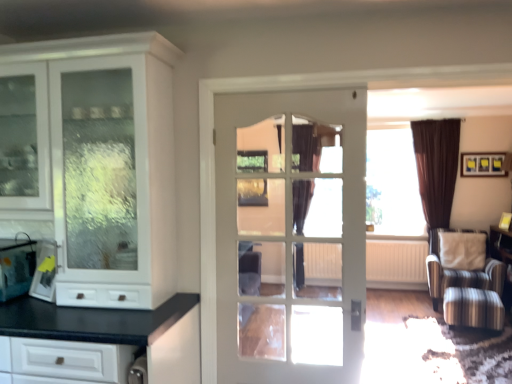
Question: Is beige fabric pillow at right taller or shorter than white glossy cabinet at left?

Choices:
 (A) short
 (B) tall

Answer: (A)

Question: From the image's perspective, relative to white glossy cabinet at left, is beige fabric pillow at right above or below?

Choices:
 (A) above
 (B) below

Answer: (B)

Question: Estimate the real-world distances between objects in this image. Which object is farther from the white textured radiator at center?

Choices:
 (A) metallic silver bag at left, arranged as the 1th appliance when viewed from the left
 (B) black velvet curtain at center
 (C) beige fabric pillow at right
 (D) white glossy cabinet at left
 (E) white glass door at center

Answer: (A)

Question: Considering the real-world distances, which object is farthest from the metallic silver bag at left, arranged as the 1th appliance when viewed from the left?

Choices:
 (A) white glossy cabinet at left
 (B) yellow plastic bag at left, the second appliance positioned from the left
 (C) black velvet curtain at center
 (D) white textured radiator at center
 (E) striped fabric armchair at right

Answer: (E)